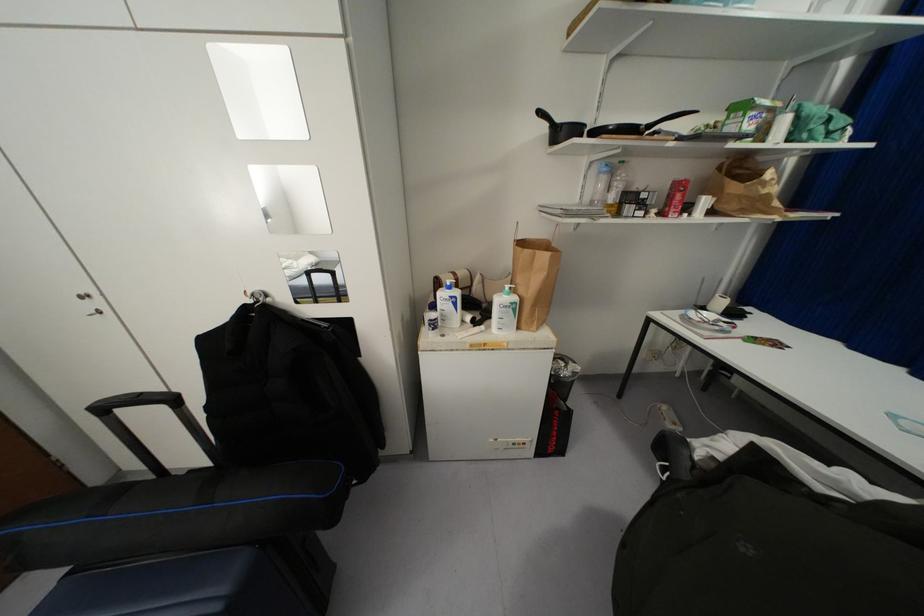
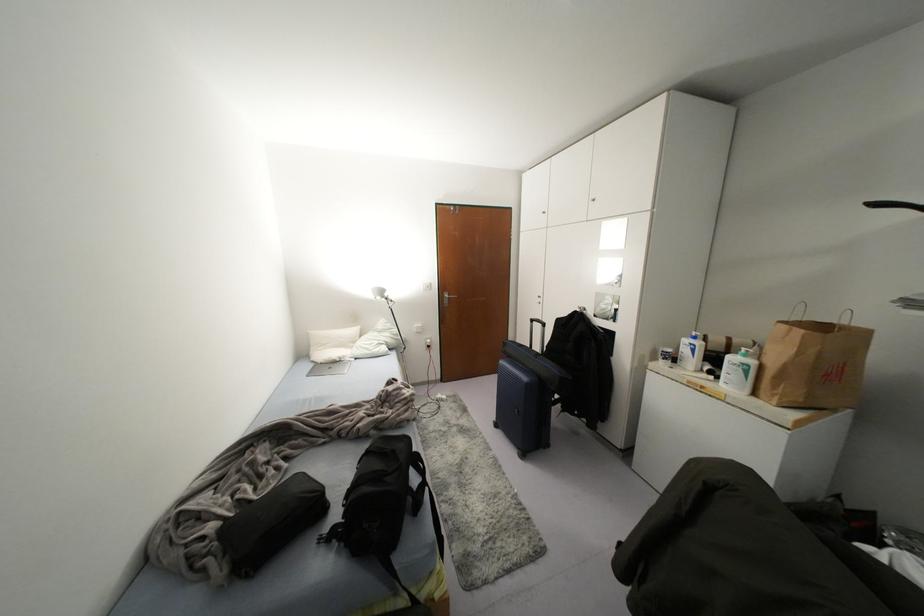
Find the pixel in the second image that matches (175,400) in the first image.

(542, 323)